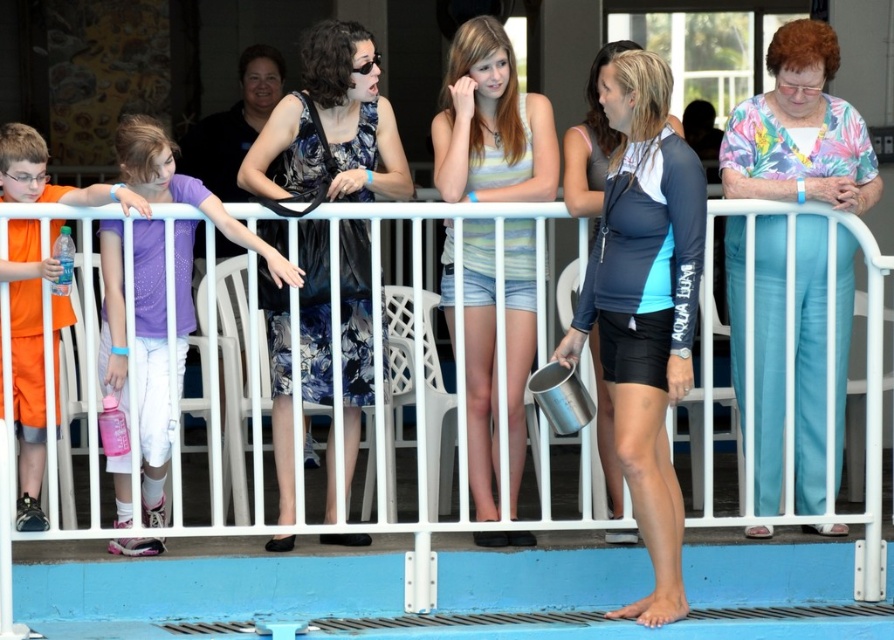
In the scene shown: You are standing at the position of point (475,202) and want to walk towards the camera. Which direction should you move to reach the camera without passing through point (817,444)?

Since point (817,444) is further away from the camera than point (475,202), you should move towards the direction of the camera by going towards the area closer to the camera, which would be away from point (817,444). However, the exact direction depends on the spatial layout not provided here.

You are a photographer at the event. You need to capture a photo where both the floral fabric blouse at right and the striped tank top at center are visible. Based on their positions, which one will appear higher in the photo?

The floral fabric blouse at right will appear higher in the photo because it is positioned above the striped tank top at center.